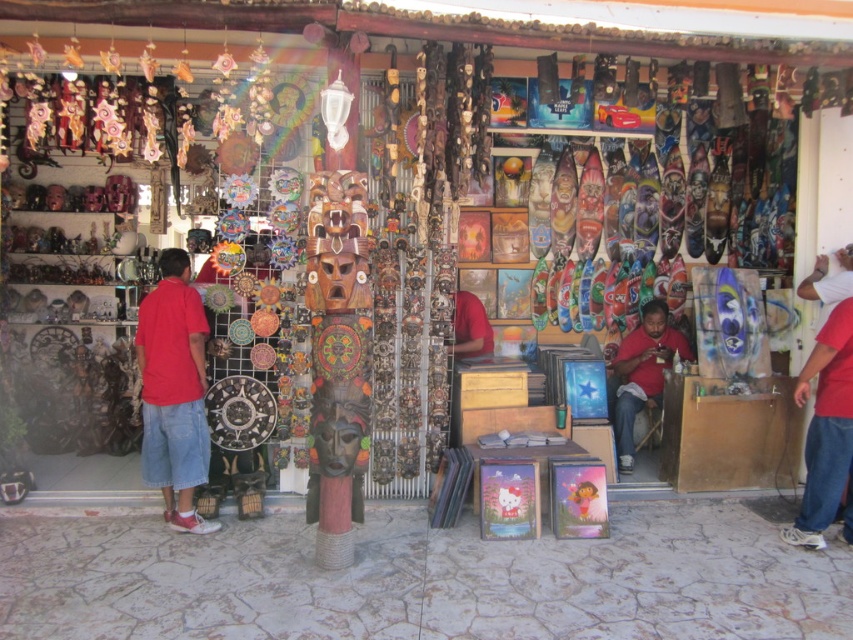
Is point (160, 422) behind point (622, 348)?

No.

Which is more to the left, red cotton shirt at left or matte red shirt at center?

red cotton shirt at left is more to the left.

Looking at this image, who is more forward, (200, 401) or (659, 372)?

Point (200, 401)

At what (x,y) coordinates should I click in order to perform the action: click on red cotton shirt at left. Please return your answer as a coordinate pair (x, y). Looking at the image, I should click on (173, 392).